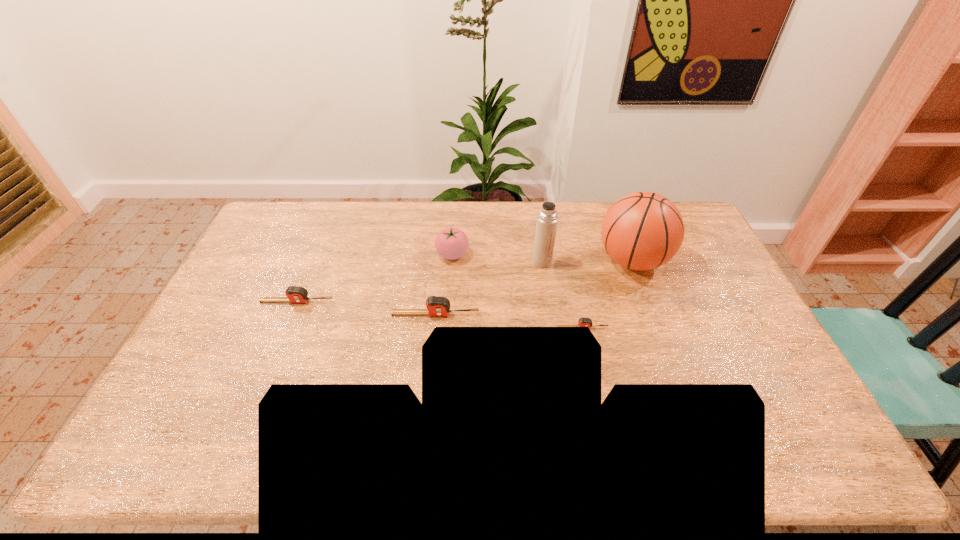
The tape measures are evenly distributed in the image. To maintain this, where would you place another tape measure on the right? Please point to a free space. Please provide its 2D coordinates. Your answer should be formatted as a tuple, i.e. [(x, y)], where the tuple contains the x and y coordinates of a point satisfying the conditions above.

[(737, 342)]